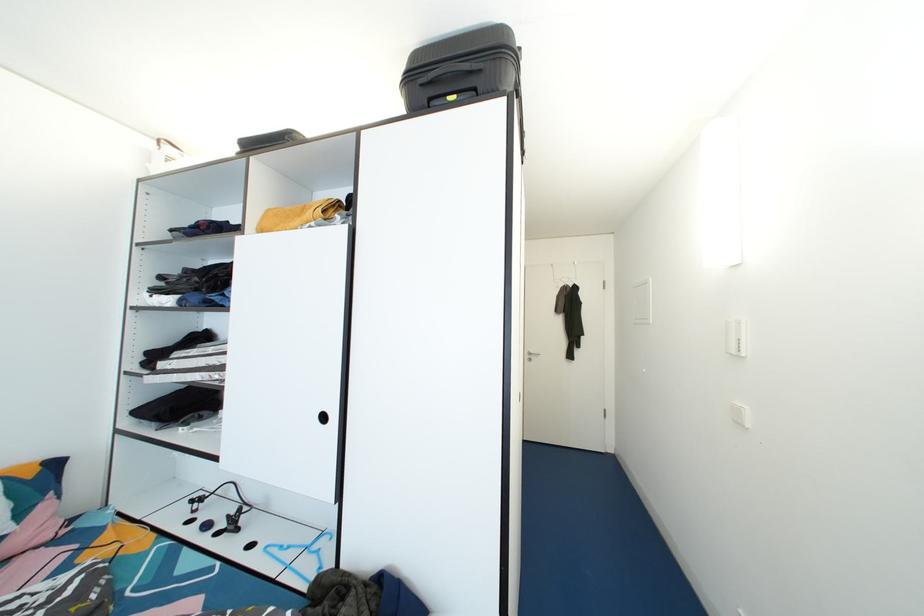
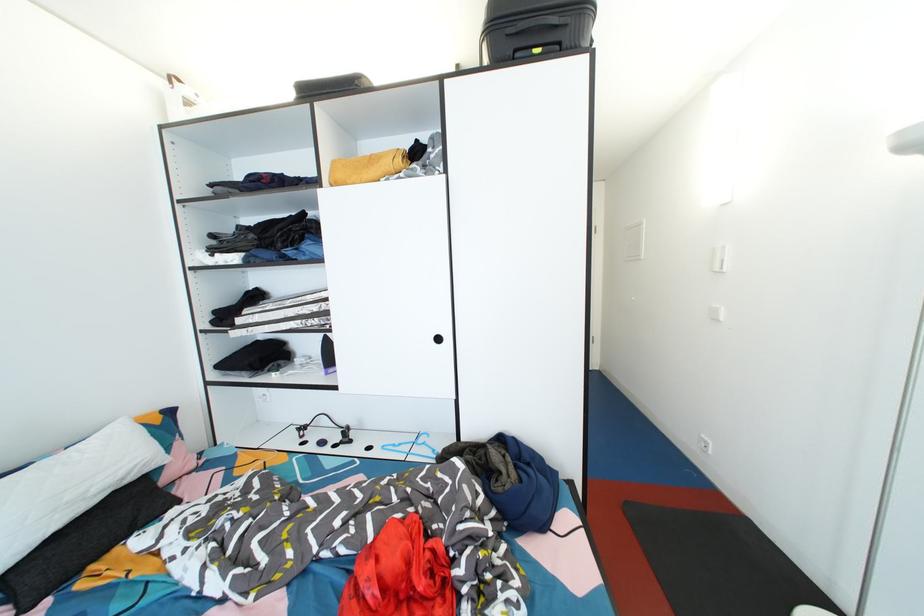
Find the pixel in the second image that matches pixel 331 423 in the first image.

(444, 344)